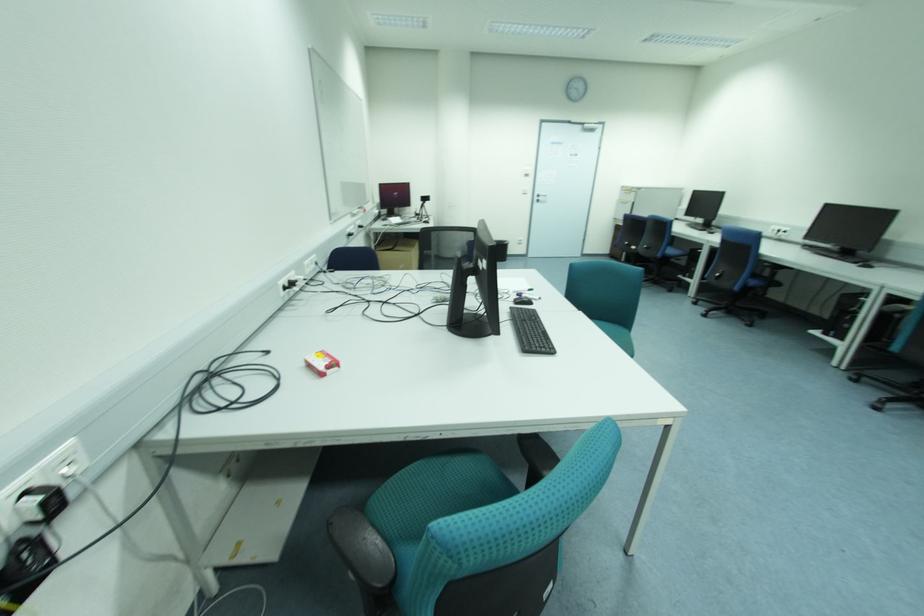
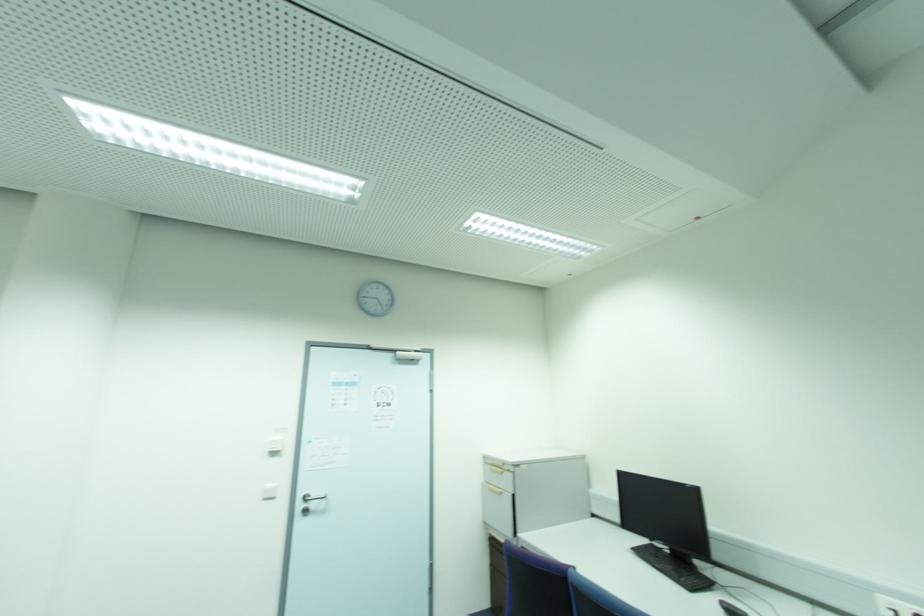
In the second image, find the point that corresponds to point 630,193 in the first image.

(503, 472)